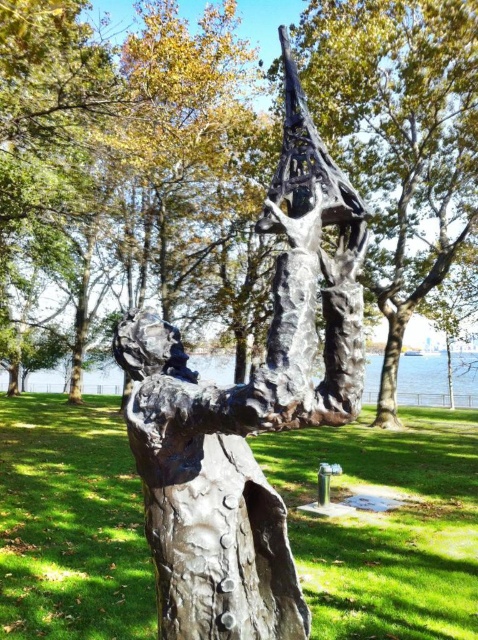
You are a gardener who needs to mow the lawn. You see the green grass at center and the smooth brown tree trunk at center. Which one should you avoid cutting with the lawnmower?

You should avoid cutting the smooth brown tree trunk at center because it is taller than the green grass at center, and lawnmowers are meant for cutting grass, not tree trunks.

You are standing in the park where the sculpture is located. You see a point marked at coordinates (386, 525). What is located at that point?

The point at coordinates (386, 525) corresponds to green grass at center.